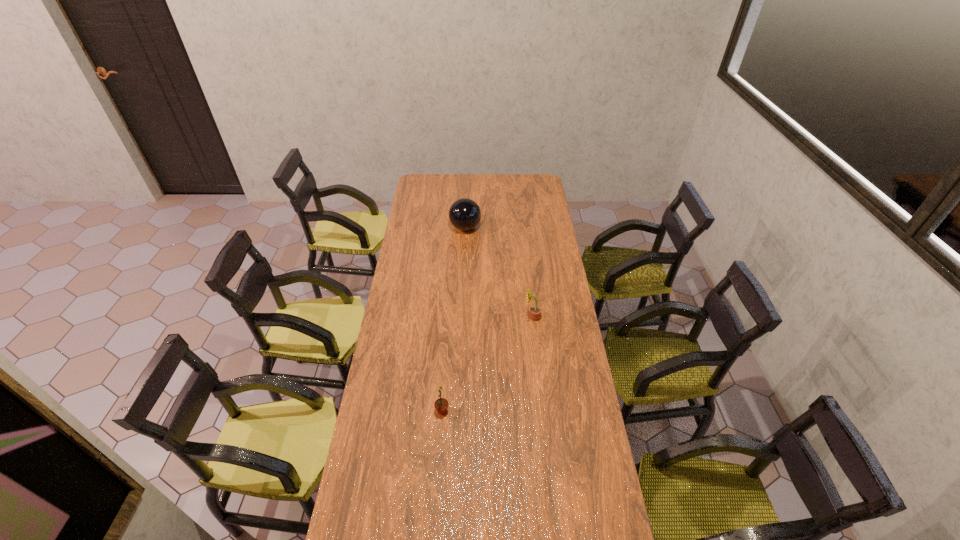
The image size is (960, 540). I want to click on vacant space that's between the rightmost object and the left sunflower, so click(488, 364).

Locate an element on the screen. The height and width of the screenshot is (540, 960). free space between the nearer sunflower and the rightmost object is located at coordinates (488, 364).

I want to click on free point between the farther sunflower and the left sunflower, so click(488, 364).

You are a GUI agent. You are given a task and a screenshot of the screen. Output one action in this format:
    pyautogui.click(x=<x>, y=<y>)
    Task: Click on the unoccupied area between the nearest object and the second farthest object
    The width and height of the screenshot is (960, 540).
    Given the screenshot: What is the action you would take?
    pyautogui.click(x=488, y=364)

This screenshot has height=540, width=960. I want to click on free area in between the farther sunflower and the bowling ball, so click(x=499, y=272).

Identify the location of object that stands as the closest to the nearer sunflower. The width and height of the screenshot is (960, 540). (535, 311).

Point out which object is positioned as the nearest to the second farthest object. Please provide its 2D coordinates. Your answer should be formatted as a tuple, i.e. [(x, y)], where the tuple contains the x and y coordinates of a point satisfying the conditions above.

[(441, 404)]